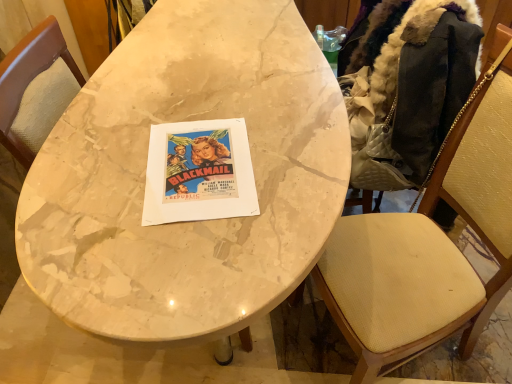
What is the approximate height of dark brown fur-lined jacket at right?

dark brown fur-lined jacket at right is 21.20 inches in height.

You are a GUI agent. You are given a task and a screenshot of the screen. Output one action in this format:
    pyautogui.click(x=<x>, y=<y>)
    Task: Click on the wooden textured chair at right
    
    Given the screenshot: What is the action you would take?
    pyautogui.click(x=429, y=244)

The height and width of the screenshot is (384, 512). Find the location of `marble table at center`. marble table at center is located at coordinates (145, 170).

Which of these two, wooden textured chair at right or dark brown fur-lined jacket at right, is thinner?

Thinner between the two is dark brown fur-lined jacket at right.

Is wooden textured chair at right in contact with dark brown fur-lined jacket at right?

No, wooden textured chair at right is not next to dark brown fur-lined jacket at right.

From the image's perspective, is wooden textured chair at right located above or below dark brown fur-lined jacket at right?

Based on their image positions, wooden textured chair at right is located beneath dark brown fur-lined jacket at right.

Could dark brown fur-lined jacket at right be considered to be inside wooden textured chair at right?

No.

Is marble table at center taller or shorter than wooden textured chair at right?

Considering their sizes, marble table at center has less height than wooden textured chair at right.

Is marble table at center facing away from wooden textured chair at right?

marble table at center does not have its back to wooden textured chair at right.

At what (x,y) coordinates should I click in order to perform the action: click on table above the wooden textured chair at right (from the image's perspective). Please return your answer as a coordinate pair (x, y). Image resolution: width=512 pixels, height=384 pixels. Looking at the image, I should click on (145, 170).

Between marble table at center and wooden textured chair at right, which one has smaller size?

wooden textured chair at right.

Is marble table at center turned away from dark brown fur-lined jacket at right?

That's not correct — marble table at center is not looking away from dark brown fur-lined jacket at right.

The image size is (512, 384). I want to click on table that is under the dark brown fur-lined jacket at right (from a real-world perspective), so click(x=145, y=170).

Who is taller, marble table at center or dark brown fur-lined jacket at right?

marble table at center is taller.

Based on the photo, from the image's perspective, which is above, marble table at center or dark brown fur-lined jacket at right?

dark brown fur-lined jacket at right appears higher in the image.

From a real-world perspective, is wooden textured chair at right located higher than marble table at center?

Yes, from a real-world perspective, wooden textured chair at right is on top of marble table at center.

Is wooden textured chair at right facing towards marble table at center?

Yes, wooden textured chair at right is oriented towards marble table at center.

What's the angular difference between wooden textured chair at right and marble table at center's facing directions?

156 degrees.

Where is `chair that appears in front of the dark brown fur-lined jacket at right`? chair that appears in front of the dark brown fur-lined jacket at right is located at coordinates (429, 244).

From their relative heights in the image, would you say dark brown fur-lined jacket at right is taller or shorter than wooden textured chair at right?

dark brown fur-lined jacket at right is shorter than wooden textured chair at right.

Is wooden textured chair at right a part of dark brown fur-lined jacket at right?

No, wooden textured chair at right is not a part of dark brown fur-lined jacket at right.

Can you tell me how much dark brown fur-lined jacket at right and wooden textured chair at right differ in facing direction?

They differ by 90.9 degrees in their facing directions.

Is dark brown fur-lined jacket at right situated inside marble table at center or outside?

dark brown fur-lined jacket at right is not inside marble table at center, it's outside.

Measure the distance from dark brown fur-lined jacket at right to marble table at center.

They are 17.76 inches apart.

In terms of width, does dark brown fur-lined jacket at right look wider or thinner when compared to marble table at center?

In the image, dark brown fur-lined jacket at right appears to be more narrow than marble table at center.

Identify the location of jacket lying above the wooden textured chair at right (from the image's perspective). pos(399,84).

You are a GUI agent. You are given a task and a screenshot of the screen. Output one action in this format:
    pyautogui.click(x=<x>, y=<y>)
    Task: Click on the chair that is on the right side of marble table at center
    This screenshot has width=512, height=384.
    Given the screenshot: What is the action you would take?
    pyautogui.click(x=429, y=244)

Consider the image. Which object lies nearer to the anchor point dark brown fur-lined jacket at right, marble table at center or wooden textured chair at right?

The object closer to dark brown fur-lined jacket at right is wooden textured chair at right.

Looking at this image, when comparing their distances from marble table at center, does dark brown fur-lined jacket at right or wooden textured chair at right seem closer?

The object closer to marble table at center is dark brown fur-lined jacket at right.

From the image, which object appears to be nearer to wooden textured chair at right, dark brown fur-lined jacket at right or marble table at center?

dark brown fur-lined jacket at right is closer to wooden textured chair at right.

When comparing their distances from marble table at center, does wooden textured chair at right or dark brown fur-lined jacket at right seem closer?

Based on the image, dark brown fur-lined jacket at right appears to be nearer to marble table at center.

Looking at this image, based on their spatial positions, is marble table at center or dark brown fur-lined jacket at right closer to wooden textured chair at right?

The object closer to wooden textured chair at right is dark brown fur-lined jacket at right.

Estimate the real-world distances between objects in this image. Which object is further from dark brown fur-lined jacket at right, wooden textured chair at right or marble table at center?

The object further to dark brown fur-lined jacket at right is marble table at center.

I want to click on chair between marble table at center and dark brown fur-lined jacket at right from left to right, so click(x=429, y=244).